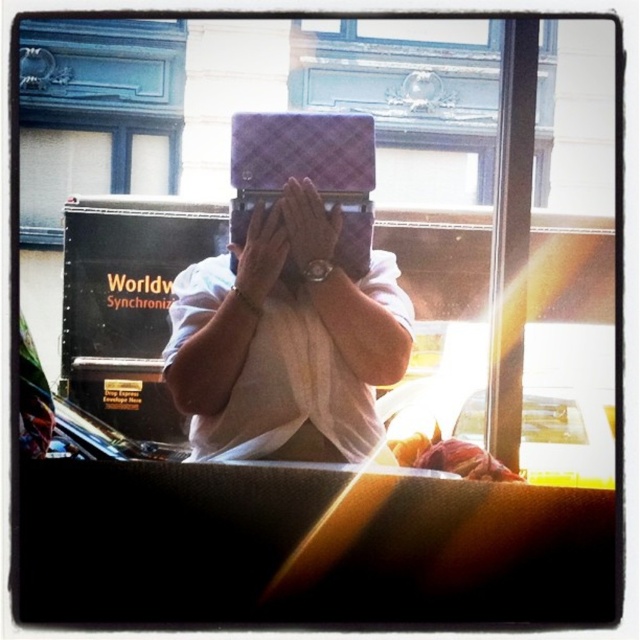
You are a photographer trying to capture a candid shot of the person holding the matte purple laptop at center from your position. Considering the distance between you and the laptop, can you use a standard smartphone camera to clearly capture the details of the laptop screen?

The distance between the matte purple laptop at center and the camera is 13.32 feet. A standard smartphone camera typically has difficulty capturing clear details at such a distance, so it might not be possible to clearly see the laptop screen.

You are a photographer trying to capture a candid shot of the person in the train. The person is holding a matte purple laptop at center and has a matte white hand at center. To avoid blurring the shot, you need to ensure the camera focuses on the closest object. Which object should you focus on?

The matte white hand at center is closer to the camera than the matte purple laptop at center, so you should focus on the matte white hand at center to avoid blurring the shot.

You are a passenger on a train and you see a matte purple laptop at center and a matte white hand at center. Which object takes up more space in the image?

The matte white hand at center takes up more space in the image because it is larger than the matte purple laptop at center.